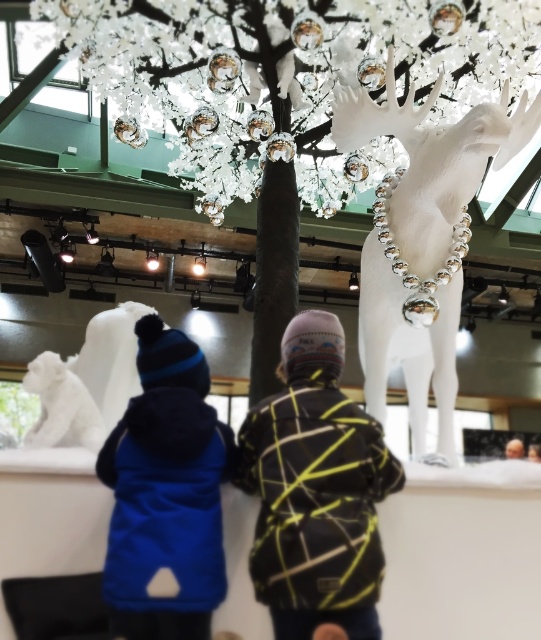
Question: Can you confirm if yellow-green textured jacket at center is smaller than blue soft vest at center?

Choices:
 (A) no
 (B) yes

Answer: (A)

Question: Which of the following is the closest to the observer?

Choices:
 (A) smooth brown hair at upper center
 (B) white fur tiger at lower left

Answer: (B)

Question: Does white matte sculpture at left have a greater width compared to white fur tiger at lower left?

Choices:
 (A) no
 (B) yes

Answer: (B)

Question: From the image, what is the correct spatial relationship of white glossy deer at upper right in relation to blue soft vest at center?

Choices:
 (A) below
 (B) above

Answer: (B)

Question: Based on their relative distances, which object is nearer to the smooth brown hair at upper center?

Choices:
 (A) yellow-green textured jacket at center
 (B) white matte sculpture at left
 (C) white fur tiger at lower left

Answer: (B)

Question: Which point is farther to the camera?

Choices:
 (A) (85, 426)
 (B) (524, 445)
 (C) (300, 36)

Answer: (B)